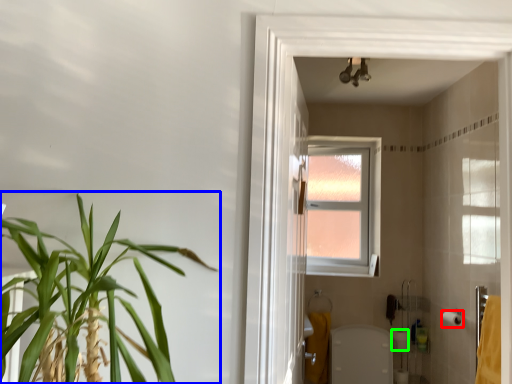
Question: Which is farther away from toilet paper (highlighted by a red box)? houseplant (highlighted by a blue box) or toilet paper (highlighted by a green box)?

Choices:
 (A) houseplant
 (B) toilet paper

Answer: (A)